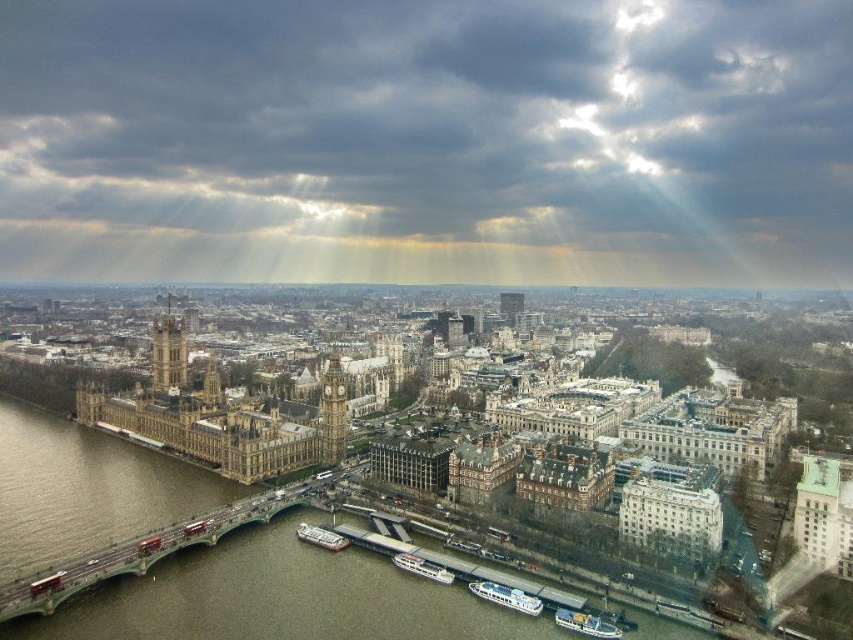
Question: Can you confirm if cloudy sky at upper center is positioned to the right of white glossy boat at lower center?

Choices:
 (A) no
 (B) yes

Answer: (A)

Question: Is white matte boat at lower center bigger than white plastic boat at lower center?

Choices:
 (A) yes
 (B) no

Answer: (B)

Question: Estimate the real-world distances between objects in this image. Which object is farther from the golden stone tower at center-left?

Choices:
 (A) white glossy boat at lower center
 (B) metallic gray bridge at lower left
 (C) cloudy sky at upper center

Answer: (C)

Question: Which object appears closest to the camera in this image?

Choices:
 (A) white matte boat at lower center
 (B) cloudy sky at upper center

Answer: (A)

Question: Is cloudy sky at upper center wider than metallic gray bridge at lower left?

Choices:
 (A) yes
 (B) no

Answer: (A)

Question: Which object is the closest to the white plastic boat at lower right?

Choices:
 (A) white plastic boat at lower center
 (B) white glossy boat at lower center

Answer: (B)